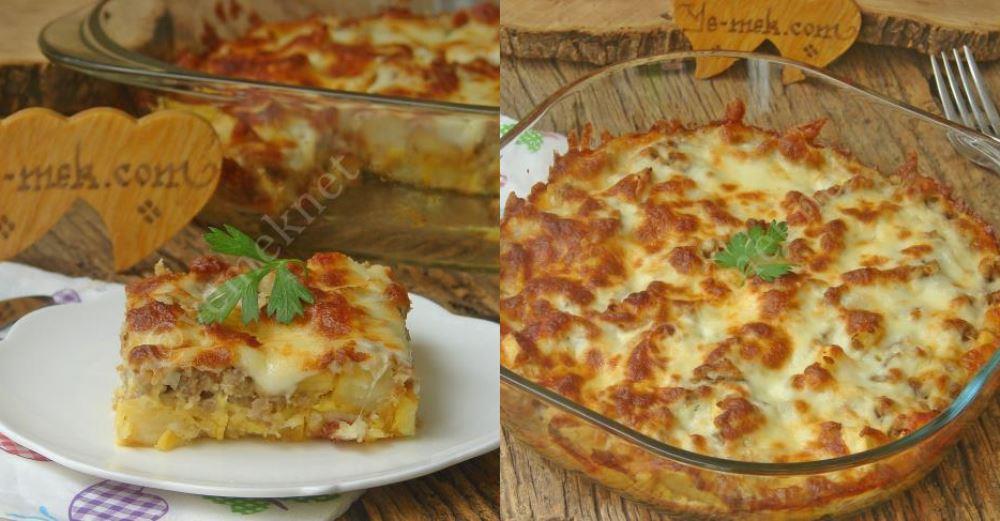
Find the location of a particular element. This screenshot has height=521, width=1000. plate is located at coordinates (391, 448).